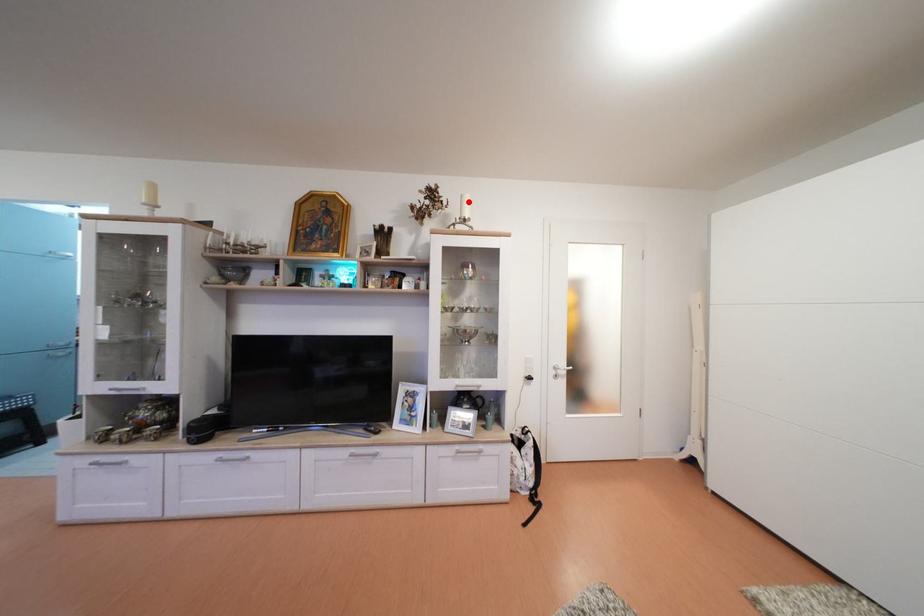
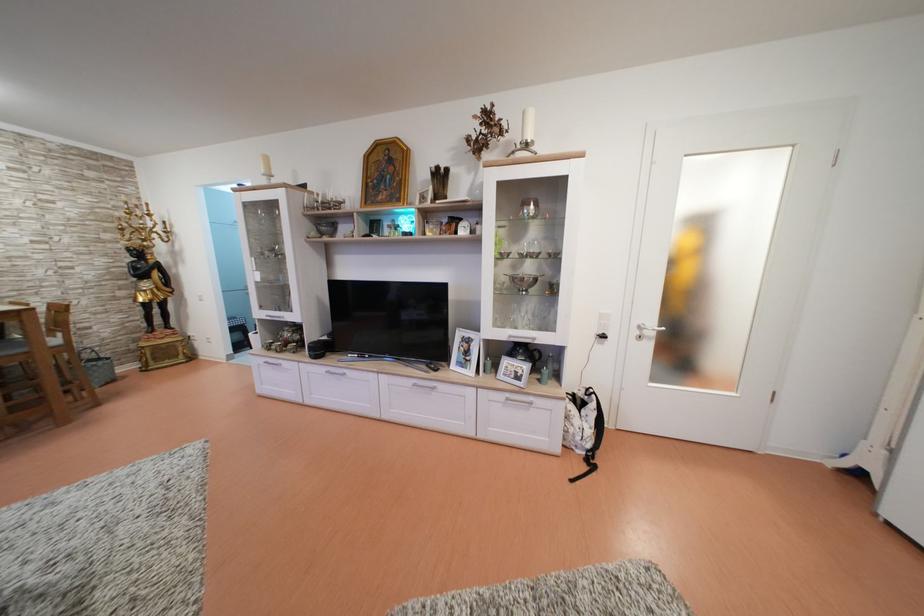
The point at the highlighted location is marked in the first image. Where is the corresponding point in the second image?

(530, 119)